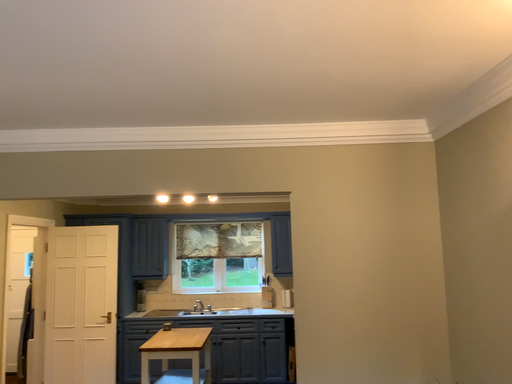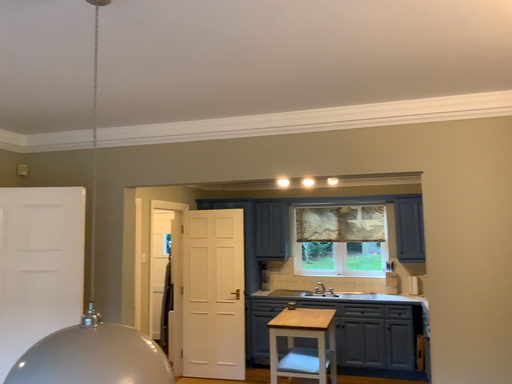
Question: Which way did the camera rotate in the video?

Choices:
 (A) rotated left
 (B) rotated right

Answer: (A)